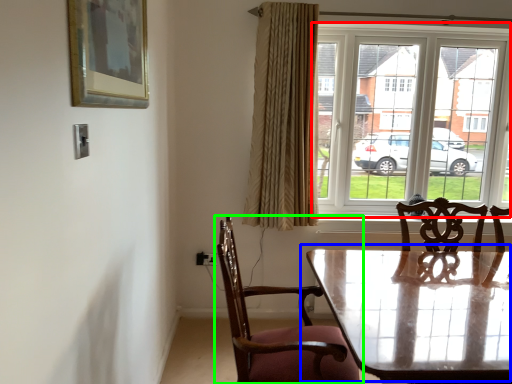
Question: Which object is positioned closest to window (highlighted by a red box)? Select from table (highlighted by a blue box) and chair (highlighted by a green box).

Choices:
 (A) table
 (B) chair

Answer: (A)